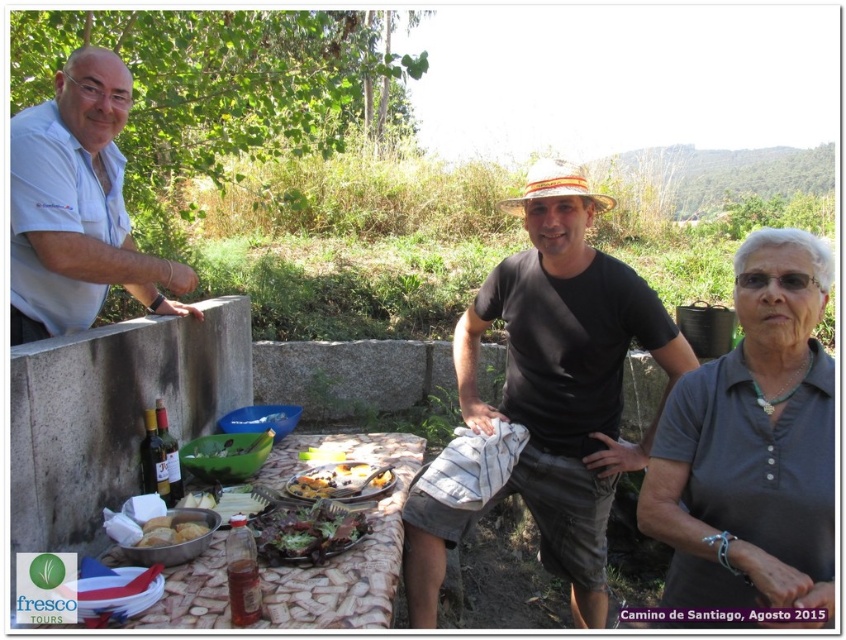
Who is more distant from viewer, (640, 321) or (168, 538)?

Positioned behind is point (640, 321).

Can you confirm if black cotton shirt at center is positioned below golden crusty bread at lower left?

Actually, black cotton shirt at center is above golden crusty bread at lower left.

Which is behind, point (575, 294) or point (168, 531)?

Point (575, 294)

Where is `black cotton shirt at center`? The height and width of the screenshot is (640, 846). black cotton shirt at center is located at coordinates [566, 372].

This screenshot has width=846, height=640. Identify the location of black cotton shirt at center. (566, 372).

Is black cotton shirt at center positioned before gray cotton shirt at lower right?

No, it is behind gray cotton shirt at lower right.

This screenshot has height=640, width=846. Find the location of `black cotton shirt at center`. black cotton shirt at center is located at coordinates (566, 372).

Is black cotton shirt at center to the right of green leafy salad at center from the viewer's perspective?

Yes, black cotton shirt at center is to the right of green leafy salad at center.

You are a GUI agent. You are given a task and a screenshot of the screen. Output one action in this format:
    pyautogui.click(x=<x>, y=<y>)
    Task: Click on the black cotton shirt at center
    The image size is (846, 640).
    Given the screenshot: What is the action you would take?
    pyautogui.click(x=566, y=372)

At what (x,y) coordinates should I click in order to perform the action: click on black cotton shirt at center. Please return your answer as a coordinate pair (x, y). Image resolution: width=846 pixels, height=640 pixels. Looking at the image, I should click on (566, 372).